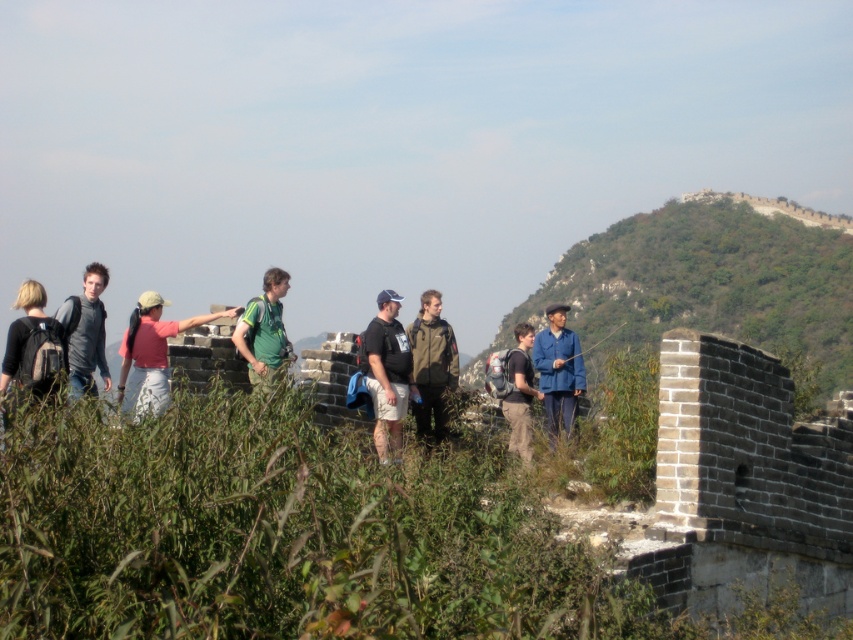
You are standing on the Great Wall and want to take a photo of the two points mentioned. Which point is closer to you, point (277,349) or point (91,324)?

Point (277,349) is closer to the viewer than point (91,324).